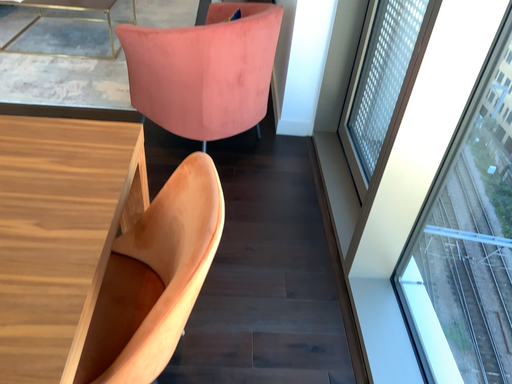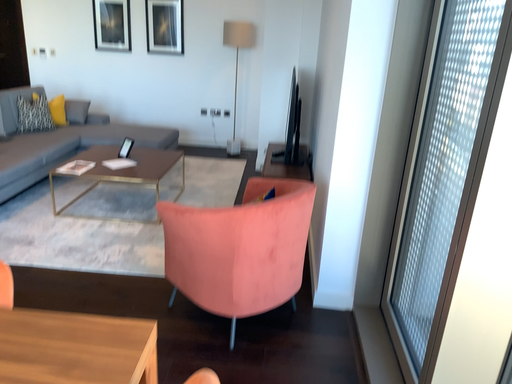
Question: How did the camera likely rotate when shooting the video?

Choices:
 (A) rotated downward
 (B) rotated upward

Answer: (B)